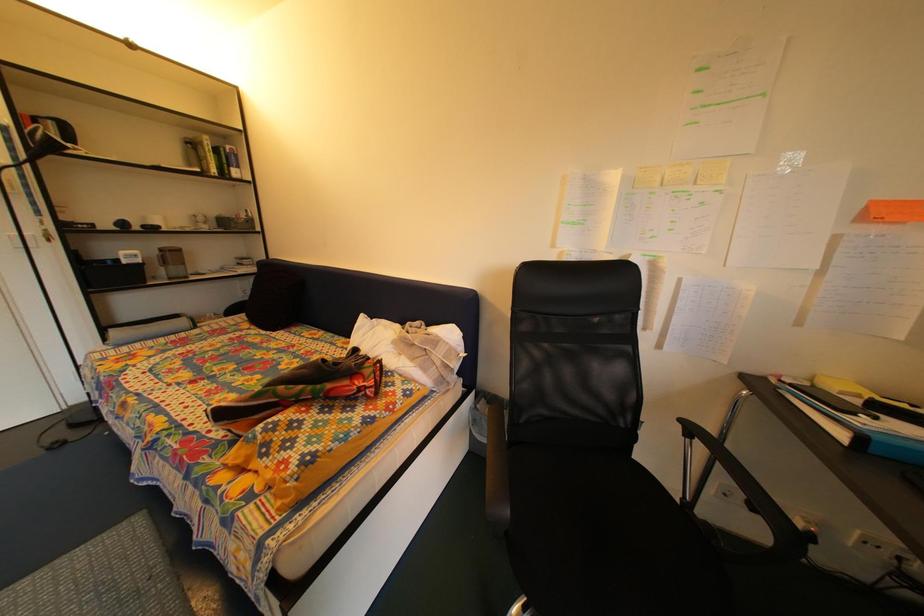
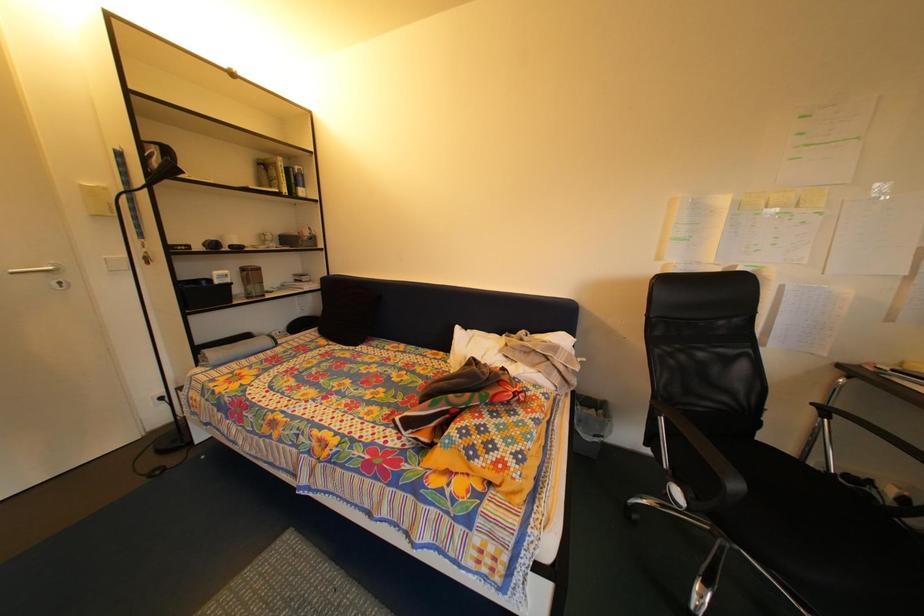
Question: What movement of the cameraman would produce the second image?

Choices:
 (A) Left
 (B) Right
 (C) Forward
 (D) Backward

Answer: (A)